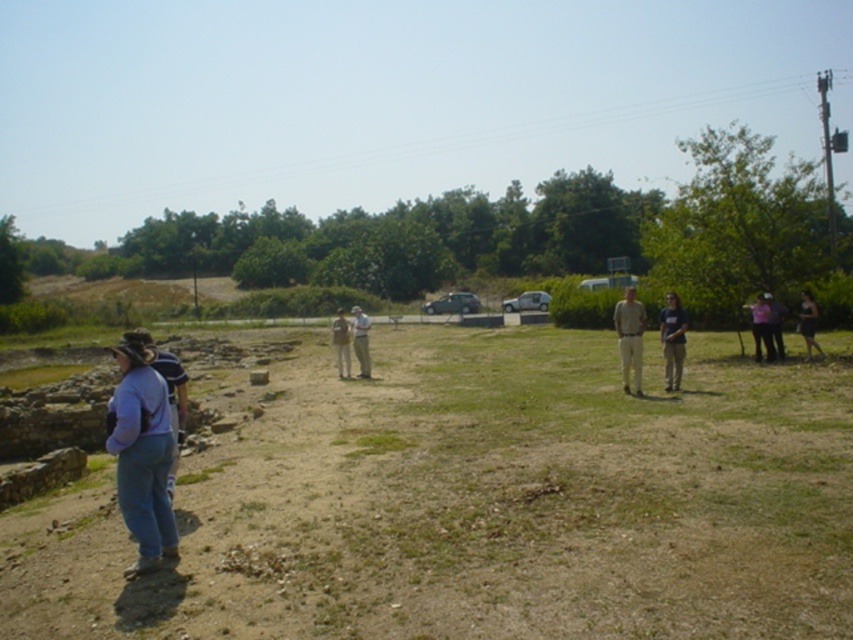
You are standing in the middle of the field and want to locate the white cotton shirt at center. According to the coordinates provided, in which direction should you move relative to your current position?

You should move to the point at coordinates (360,340) to locate the white cotton shirt at center.

You are standing in the field and want to take a photo of the white cotton shirt at center and the light brown leather jacket at center. Which one should you focus on first to ensure both are in focus?

You should focus on the white cotton shirt at center first since it is closer to the viewer than the light brown leather jacket at center, allowing the camera to adjust focus for both objects in the scene.